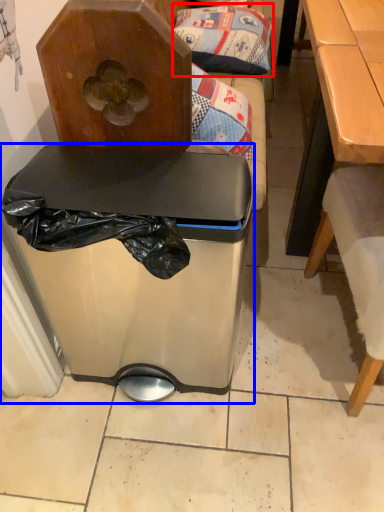
Question: Which object is closer to the camera taking this photo, pillow (highlighted by a red box) or trash bin/can (highlighted by a blue box)?

Choices:
 (A) pillow
 (B) trash bin/can

Answer: (B)